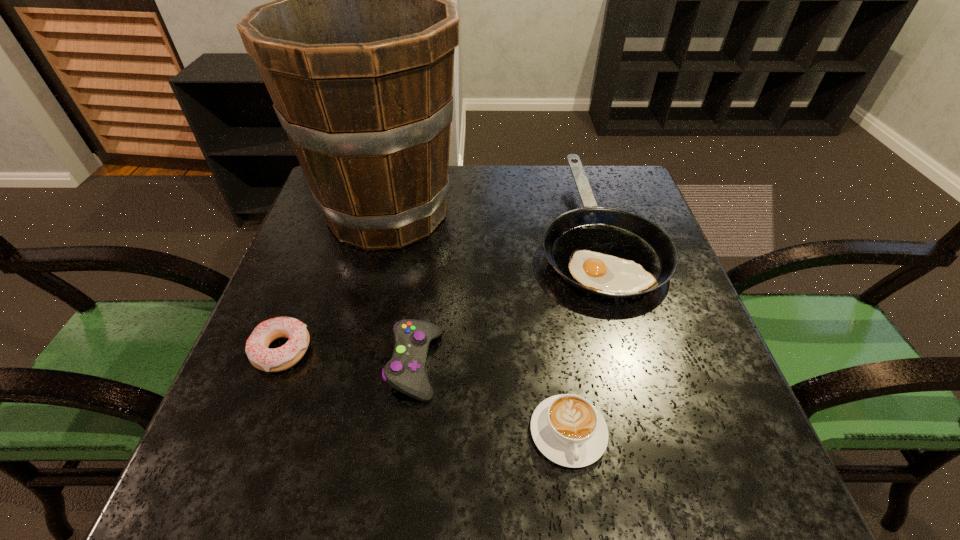
In order to click on blank region between the cappuccino and the frying pan in this screenshot , I will do `click(582, 332)`.

Where is `vacant space in between the doughnut and the frying pan`? Image resolution: width=960 pixels, height=540 pixels. vacant space in between the doughnut and the frying pan is located at coordinates (439, 291).

What are the coordinates of `free space that is in between the control and the frying pan` in the screenshot? It's located at (505, 298).

Select which object is the closest to the frying pan. Please provide its 2D coordinates. Your answer should be formatted as a tuple, i.e. [(x, y)], where the tuple contains the x and y coordinates of a point satisfying the conditions above.

[(357, 51)]

Locate an element on the screen. Image resolution: width=960 pixels, height=540 pixels. the closest object to the doughnut is located at coordinates point(405,372).

The image size is (960, 540). What are the coordinates of `free space that satisfies the following two spatial constraints: 1. on the back side of the control; 2. on the right side of the frying pan` in the screenshot? It's located at (431, 231).